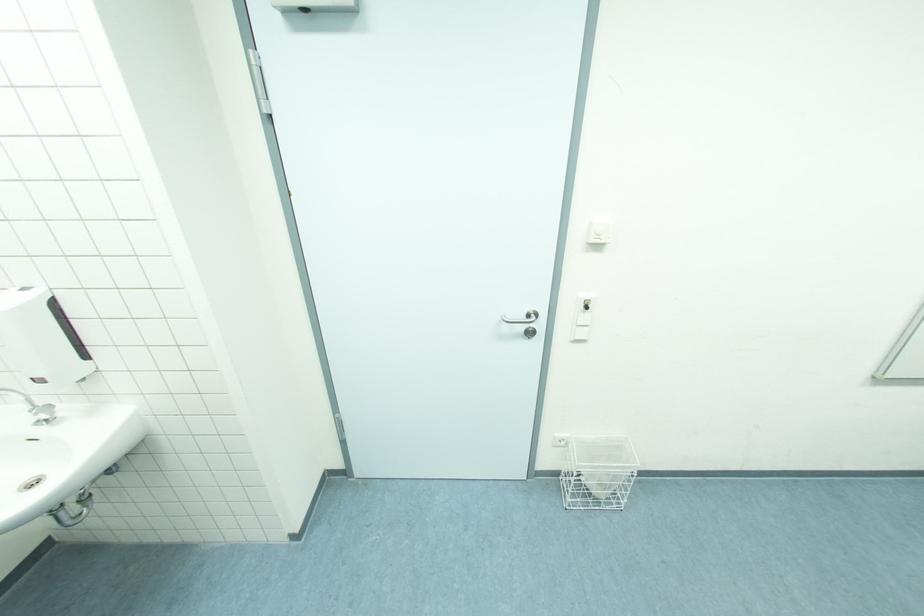
What are the coordinates of `power outlet` in the screenshot? It's located at (560, 440).